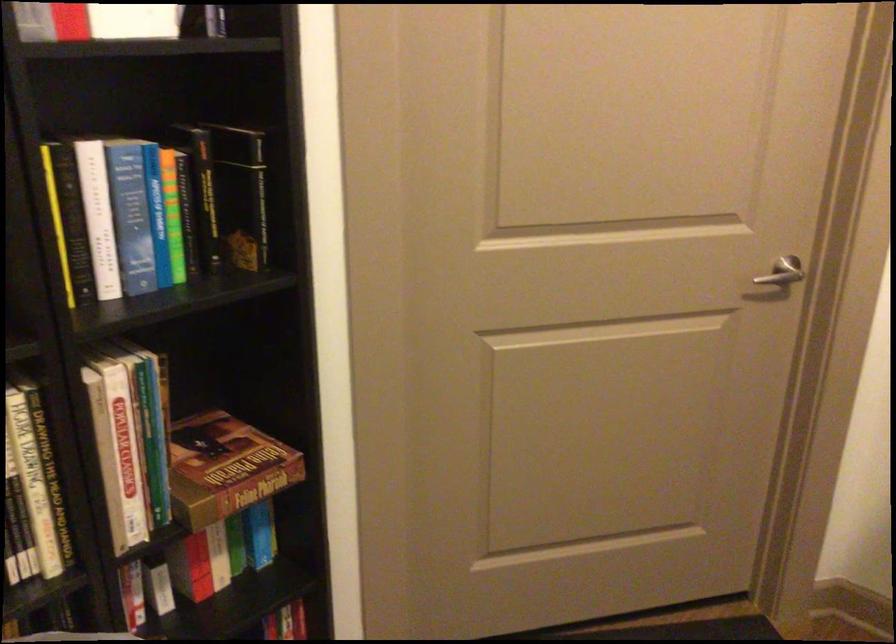
Locate an element on the screen. brown book box is located at coordinates (225, 468).